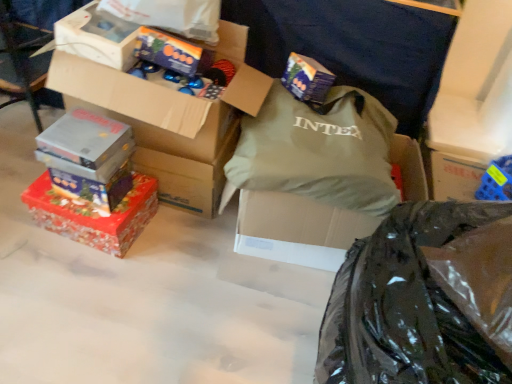
Locate an element on the screen. space that is in front of shiny metallic box at upper center, which appears as the sixth box when viewed from the left is located at coordinates (162, 81).